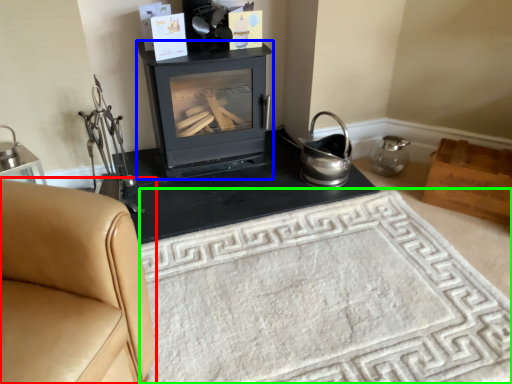
Question: Which is nearer to the furniture (highlighted by a red box)? wood burning stove (highlighted by a blue box) or doormat (highlighted by a green box).

Choices:
 (A) wood burning stove
 (B) doormat

Answer: (B)